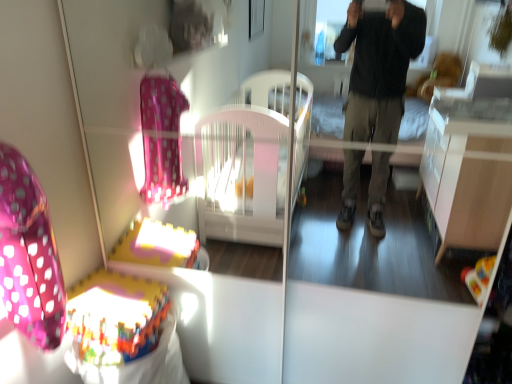
Question: Is multicolored plastic baby carriage at lower left in front of or behind pink polka dot fabric swivel chair at left in the image?

Choices:
 (A) front
 (B) behind

Answer: (B)

Question: From the image's perspective, is multicolored plastic baby carriage at lower left positioned above or below pink polka dot fabric swivel chair at left?

Choices:
 (A) below
 (B) above

Answer: (A)

Question: Would you say multicolored plastic baby carriage at lower left is to the left or to the right of pink polka dot fabric swivel chair at left in the picture?

Choices:
 (A) left
 (B) right

Answer: (B)

Question: Considering the positions of pink polka dot fabric swivel chair at left and multicolored plastic baby carriage at lower left in the image, is pink polka dot fabric swivel chair at left taller or shorter than multicolored plastic baby carriage at lower left?

Choices:
 (A) tall
 (B) short

Answer: (A)

Question: In terms of size, does pink polka dot fabric swivel chair at left appear bigger or smaller than multicolored plastic baby carriage at lower left?

Choices:
 (A) small
 (B) big

Answer: (A)

Question: From a real-world perspective, is pink polka dot fabric swivel chair at left physically located above or below multicolored plastic baby carriage at lower left?

Choices:
 (A) above
 (B) below

Answer: (A)

Question: From the image's perspective, is pink polka dot fabric swivel chair at left positioned above or below multicolored plastic baby carriage at lower left?

Choices:
 (A) above
 (B) below

Answer: (A)